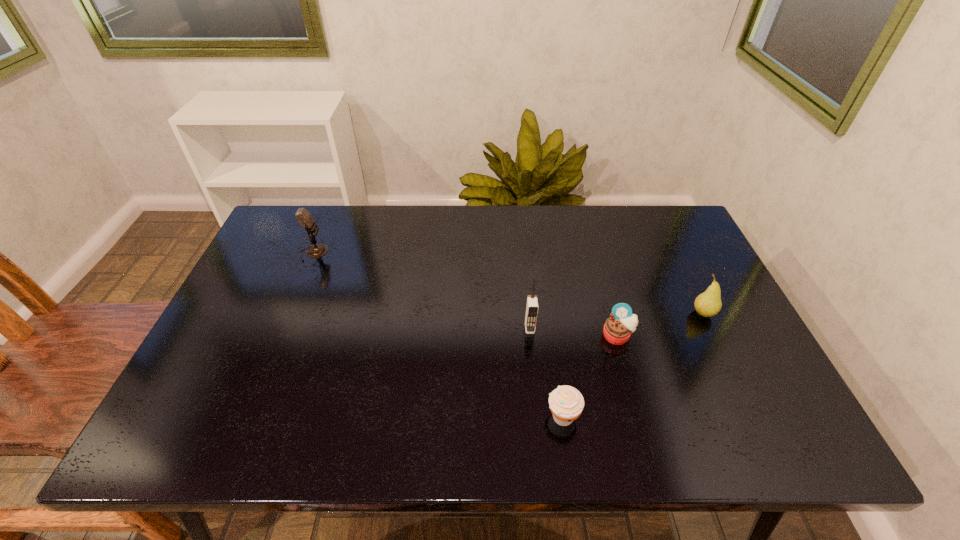
At what (x,y) coordinates should I click in order to perform the action: click on free space located 0.190m on the front-facing side of the farthest object. Please return your answer as a coordinate pair (x, y). Looking at the image, I should click on (389, 253).

Locate an element on the screen. vacant space located 0.270m on the left of the third tallest object is located at coordinates (590, 314).

The image size is (960, 540). I want to click on free spot located 0.220m on the front-facing side of the second object from right to left, so click(x=644, y=430).

At what (x,y) coordinates should I click in order to perform the action: click on free region located on the left of the left muffin. Please return your answer as a coordinate pair (x, y). The image size is (960, 540). Looking at the image, I should click on (432, 417).

Where is `object present at the far edge`? The width and height of the screenshot is (960, 540). object present at the far edge is located at coordinates (304, 218).

Locate an element on the screen. Image resolution: width=960 pixels, height=540 pixels. object present at the near edge is located at coordinates (566, 403).

Find the location of a particular element. This screenshot has width=960, height=540. object that is at the left edge is located at coordinates (304, 218).

Locate an element on the screen. object situated at the right edge is located at coordinates (707, 304).

You are a GUI agent. You are given a task and a screenshot of the screen. Output one action in this format:
    pyautogui.click(x=<x>, y=<y>)
    Task: Click on the object positioned at the far left corner
    
    Given the screenshot: What is the action you would take?
    pyautogui.click(x=304, y=218)

In order to click on vacant space at the far edge of the desktop in this screenshot , I will do `click(476, 205)`.